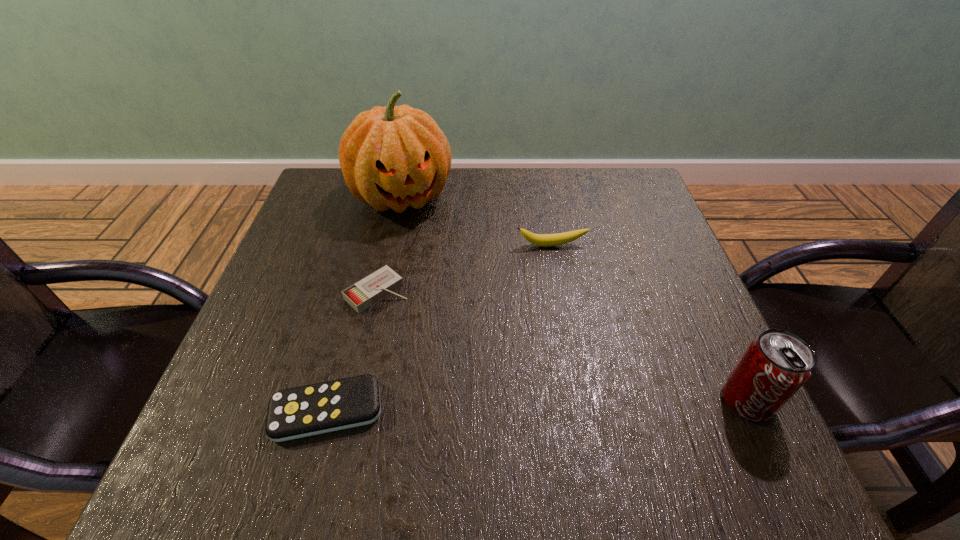
Where is `the shortest object`? This screenshot has height=540, width=960. the shortest object is located at coordinates (302, 411).

The height and width of the screenshot is (540, 960). Find the location of `the rightmost object`. the rightmost object is located at coordinates (775, 365).

Image resolution: width=960 pixels, height=540 pixels. What are the coordinates of `pop soda` in the screenshot? It's located at (775, 365).

This screenshot has width=960, height=540. I want to click on the farthest object, so click(393, 157).

Locate an element on the screen. The image size is (960, 540). the tallest object is located at coordinates (393, 157).

Find the location of a particular element. the second shortest object is located at coordinates (373, 288).

Locate an element on the screen. matchbox is located at coordinates (373, 288).

Locate an element on the screen. the second object from right to left is located at coordinates (545, 240).

What are the coordinates of `banana` in the screenshot? It's located at tap(545, 240).

Identify the location of free space located on the back of the remote control. The width and height of the screenshot is (960, 540). (361, 282).